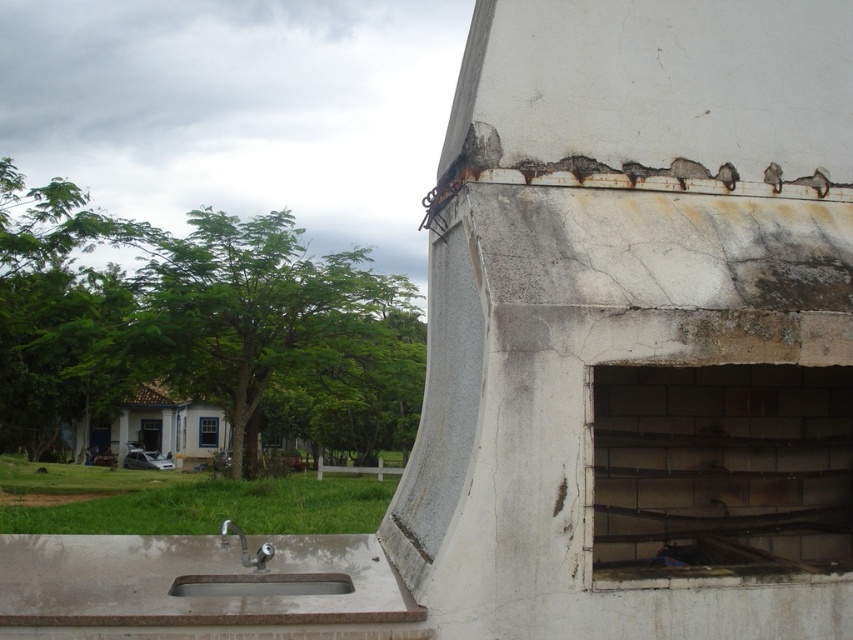
Between white concrete exhaust hood at upper right and silver metallic faucet at lower center, which one appears on the left side from the viewer's perspective?

Positioned to the left is silver metallic faucet at lower center.

Between white concrete exhaust hood at upper right and silver metallic faucet at lower center, which one has more height?

white concrete exhaust hood at upper right is taller.

This screenshot has width=853, height=640. Describe the element at coordinates (637, 324) in the screenshot. I see `white concrete exhaust hood at upper right` at that location.

You are a GUI agent. You are given a task and a screenshot of the screen. Output one action in this format:
    pyautogui.click(x=<x>, y=<y>)
    Task: Click on the white concrete exhaust hood at upper right
    This screenshot has width=853, height=640.
    Given the screenshot: What is the action you would take?
    pyautogui.click(x=637, y=324)

Does white concrete exhaust hood at upper right have a lesser width compared to rustic concrete sink at lower left?

No.

Image resolution: width=853 pixels, height=640 pixels. Describe the element at coordinates (637, 324) in the screenshot. I see `white concrete exhaust hood at upper right` at that location.

Who is more distant from viewer, (532,348) or (317,586)?

Positioned behind is point (317,586).

At what (x,y) coordinates should I click in order to perform the action: click on white concrete exhaust hood at upper right. Please return your answer as a coordinate pair (x, y). This screenshot has height=640, width=853. Looking at the image, I should click on (637, 324).

Who is taller, rusty metal bird at upper right or silver metallic faucet at lower center?

Standing taller between the two is silver metallic faucet at lower center.

Is point (772, 173) behind point (234, 529)?

Yes.

Where is `rusty metal bird at upper right`? rusty metal bird at upper right is located at coordinates (773, 177).